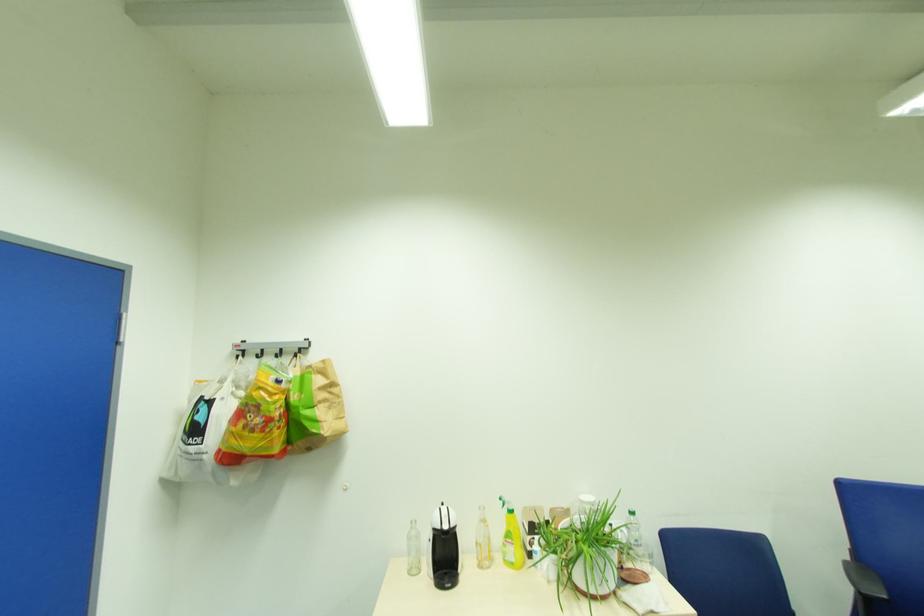
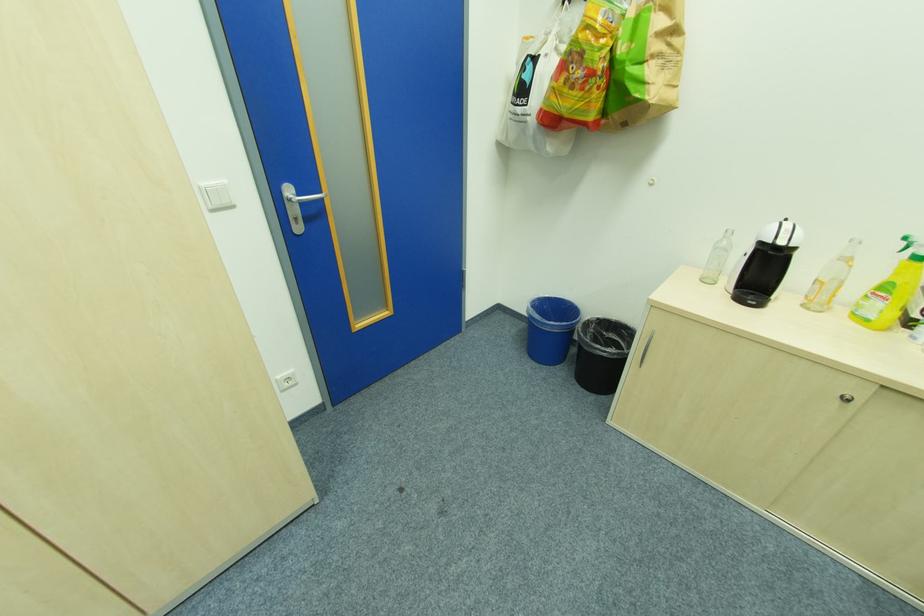
Where in the second image is the point corresponding to (417,530) from the first image?

(728, 238)